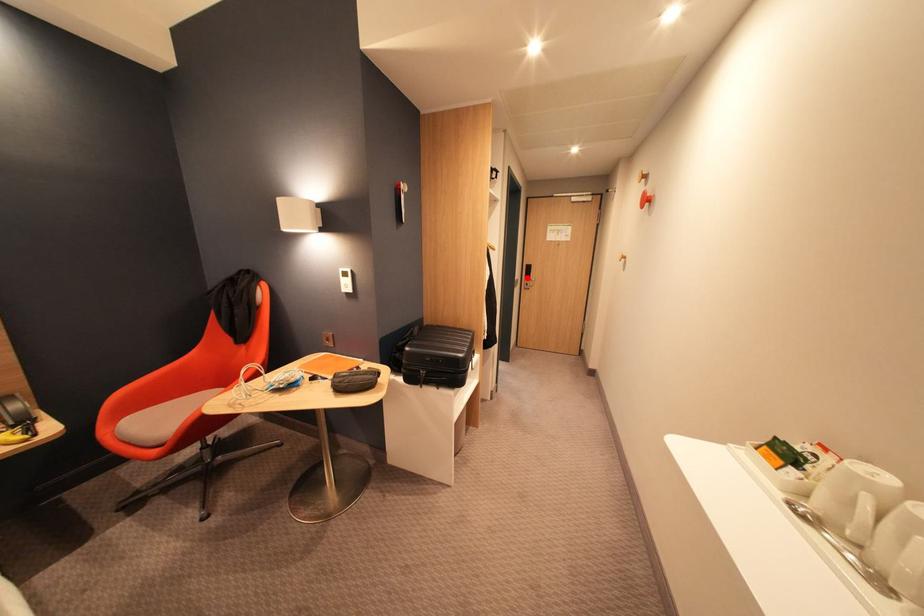
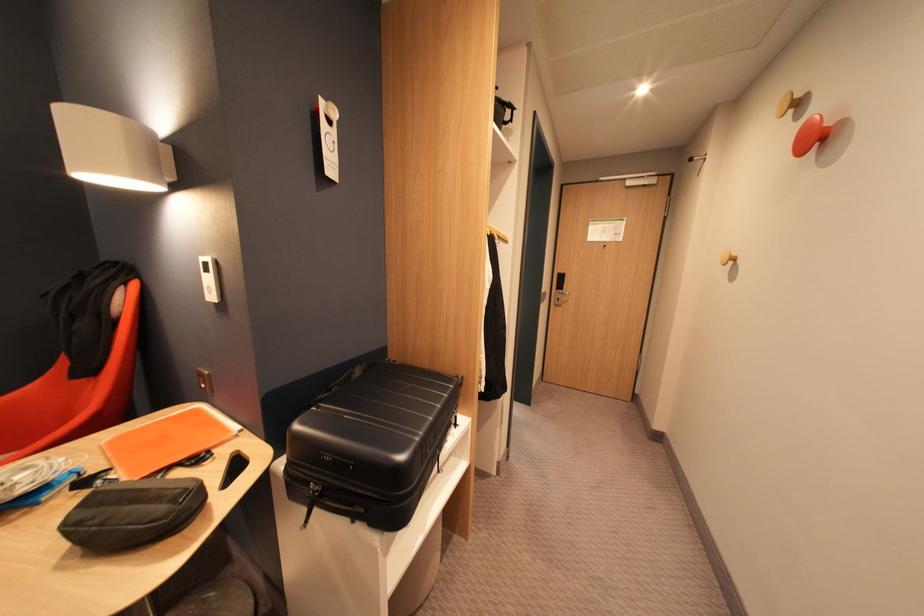
Where in the second image is the point corresponding to the highlighted location from the first image?

(555, 290)